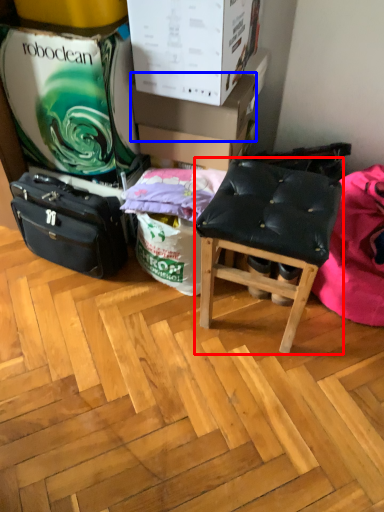
Question: Which object appears closest to the camera in this image, stool (highlighted by a red box) or cardboard box (highlighted by a blue box)?

Choices:
 (A) stool
 (B) cardboard box

Answer: (A)